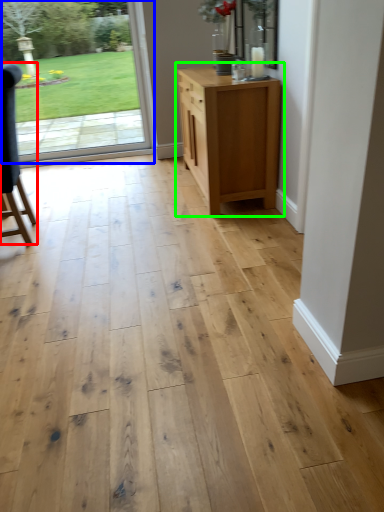
Question: Considering the real-world distances, which object is farthest from chair (highlighted by a red box)? door (highlighted by a blue box) or chest of drawers (highlighted by a green box)?

Choices:
 (A) door
 (B) chest of drawers

Answer: (A)